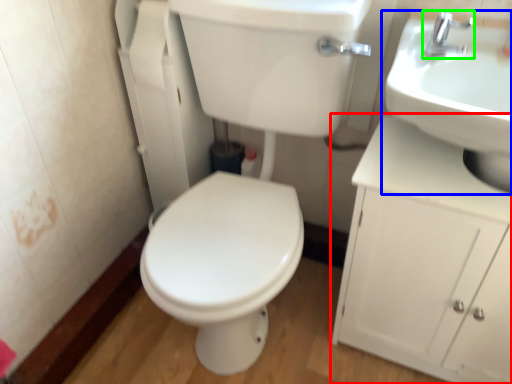
Question: Estimate the real-world distances between objects in this image. Which object is farther from bathroom cabinet (highlighted by a red box), sink (highlighted by a blue box) or tap (highlighted by a green box)?

Choices:
 (A) sink
 (B) tap

Answer: (B)